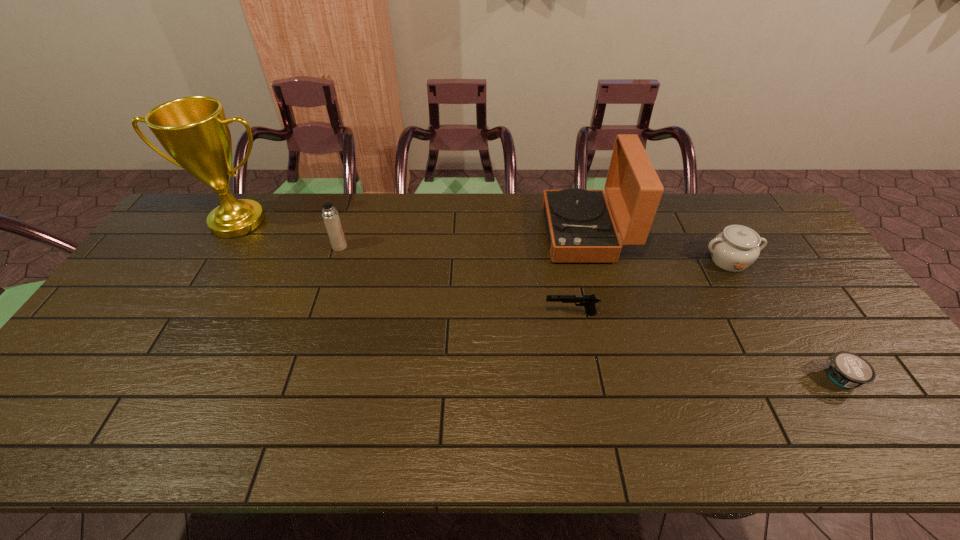
Locate an element on the screen. This screenshot has width=960, height=540. vacant point located 0.120m by the handles of the leftmost object is located at coordinates (210, 267).

Locate an element on the screen. Image resolution: width=960 pixels, height=540 pixels. vacant area situated on the face of the fifth shortest object is located at coordinates (530, 233).

You are a GUI agent. You are given a task and a screenshot of the screen. Output one action in this format:
    pyautogui.click(x=<x>, y=<y>)
    Task: Click on the vacant position located on the face of the fifth shortest object
    The image size is (960, 540).
    Given the screenshot: What is the action you would take?
    pyautogui.click(x=488, y=233)

This screenshot has height=540, width=960. What are the coordinates of `vacant point located 0.130m on the face of the fifth shortest object` in the screenshot? It's located at (506, 233).

At what (x,y) coordinates should I click in order to perform the action: click on free space located 0.110m on the left of the thermos bottle. Please return your answer as a coordinate pair (x, y). The image size is (960, 540). Looking at the image, I should click on (298, 246).

The width and height of the screenshot is (960, 540). I want to click on vacant space situated 0.200m on the front of the chinaware, so click(767, 329).

Locate an element on the screen. vacant area situated 0.290m at the aiming end of the fifth farthest object is located at coordinates pos(440,314).

Image resolution: width=960 pixels, height=540 pixels. Identify the location of vacant area situated 0.360m at the aiming end of the fifth farthest object. (414, 314).

Find the location of a particular element. The width and height of the screenshot is (960, 540). free spot located 0.290m at the aiming end of the fifth farthest object is located at coordinates (440, 314).

This screenshot has width=960, height=540. What are the coordinates of `vacant position located 0.160m on the left of the shortest object` in the screenshot? It's located at (754, 378).